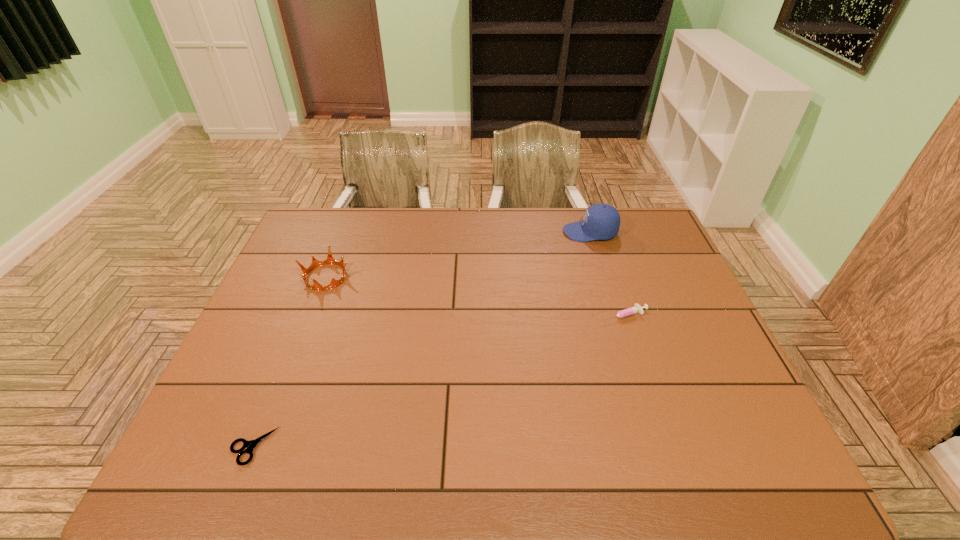
Identify the location of the tallest object. The height and width of the screenshot is (540, 960). (601, 221).

The height and width of the screenshot is (540, 960). Find the location of `the farthest object`. the farthest object is located at coordinates (601, 221).

The width and height of the screenshot is (960, 540). Find the location of `the second farthest object`. the second farthest object is located at coordinates (315, 263).

This screenshot has width=960, height=540. I want to click on crown, so click(x=315, y=263).

Find the location of a particular element. This screenshot has width=960, height=540. syringe is located at coordinates (637, 308).

Where is `the second shortest object`? the second shortest object is located at coordinates (637, 308).

Identify the location of shears. The image size is (960, 540). (250, 445).

Where is `the shortest object`? This screenshot has height=540, width=960. the shortest object is located at coordinates (250, 445).

This screenshot has width=960, height=540. What are the coordinates of `vacant space located on the front-facing side of the tallest object` in the screenshot? It's located at (454, 232).

Where is `vacant area situated 0.270m on the front-facing side of the tallest object`? This screenshot has height=540, width=960. vacant area situated 0.270m on the front-facing side of the tallest object is located at coordinates (488, 232).